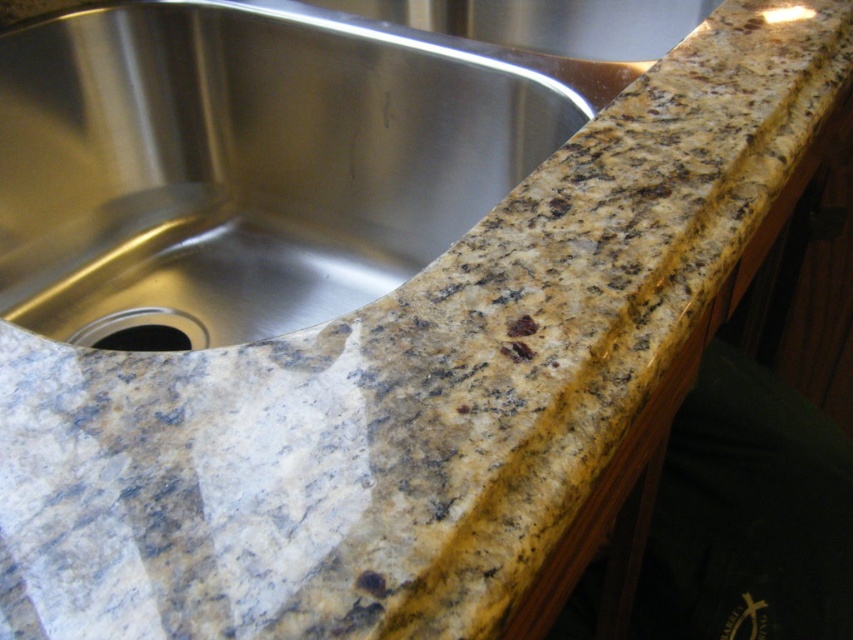
Between point (28, 256) and point (120, 326), which one is positioned in front?

Point (120, 326) is in front.

This screenshot has width=853, height=640. What do you see at coordinates (245, 163) in the screenshot?
I see `stainless steel sink at upper left` at bounding box center [245, 163].

Is point (21, 52) behind point (137, 333)?

No, (21, 52) is closer to viewer.

Where is `stainless steel sink at upper left`? This screenshot has width=853, height=640. stainless steel sink at upper left is located at coordinates (245, 163).